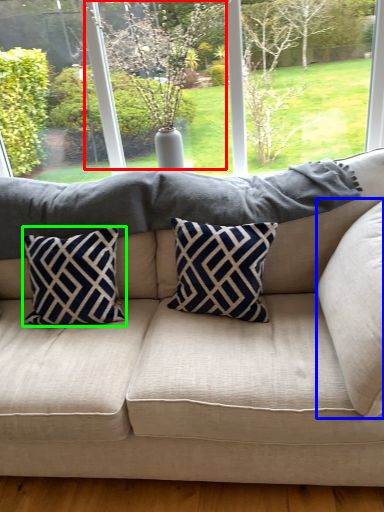
Question: Which object is the farthest from tree (highlighted by a red box)? Choose among these: pillow (highlighted by a blue box) or pillow (highlighted by a green box).

Choices:
 (A) pillow
 (B) pillow

Answer: (A)